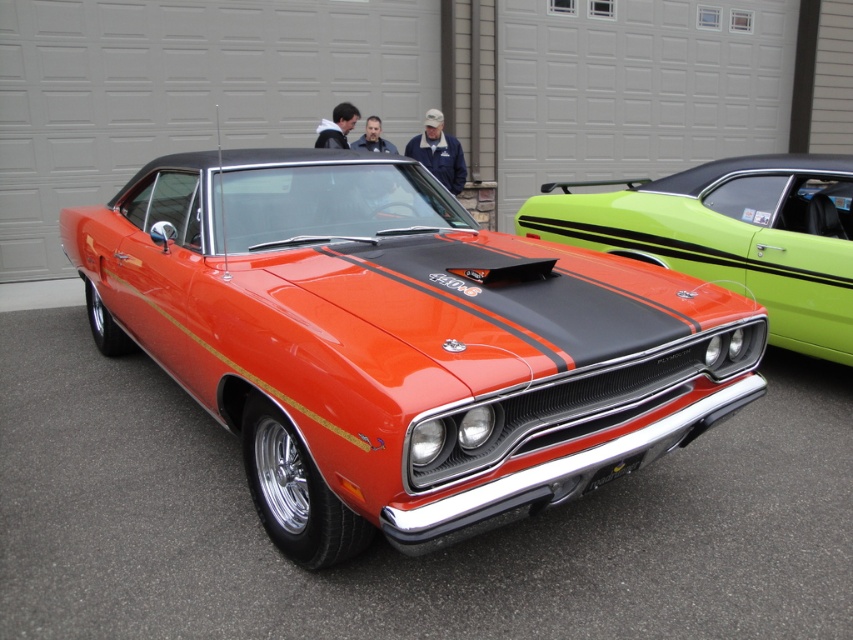
You are a photographer planning to capture both cars in a single shot. Given that the shiny orange muscle car at center is wider than the glossy orange car at center, which car should you position closer to the camera to ensure both fit within the frame?

To ensure both cars fit within the frame, position the wider shiny orange muscle car at center closer to the camera. This adjustment will help balance their apparent sizes in the photograph, as the glossy orange car at center is narrower and can be placed slightly farther back without overcrowding the composition.

You are a photographer setting up a tripod to take a photo of both the shiny orange muscle car at center and the glossy orange car at center. Which car should you focus on first to ensure it appears larger in the photo?

The shiny orange muscle car at center is much taller than the glossy orange car at center, so focusing on it first will ensure it appears larger in the photo.

You are standing in front of a residential garage where two classic muscle cars are parked. You see a shiny orange muscle car at center and a point marked at coordinates (399,342). Can you determine if the point is located on the shiny orange muscle car at center?

The point (399,342) marks the shiny orange muscle car at center, so yes, the point is located on the shiny orange muscle car at center.